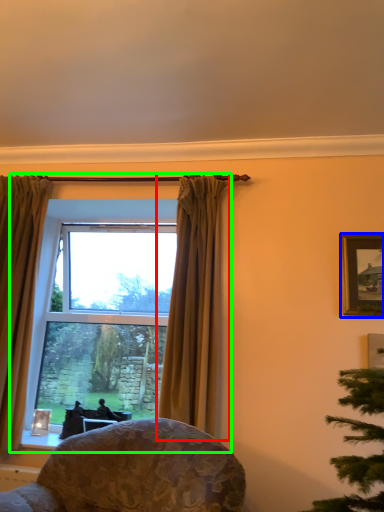
Question: Based on their relative distances, which object is nearer to curtain (highlighted by a red box)? Choose from picture frame (highlighted by a blue box) and window (highlighted by a green box).

Choices:
 (A) picture frame
 (B) window

Answer: (A)